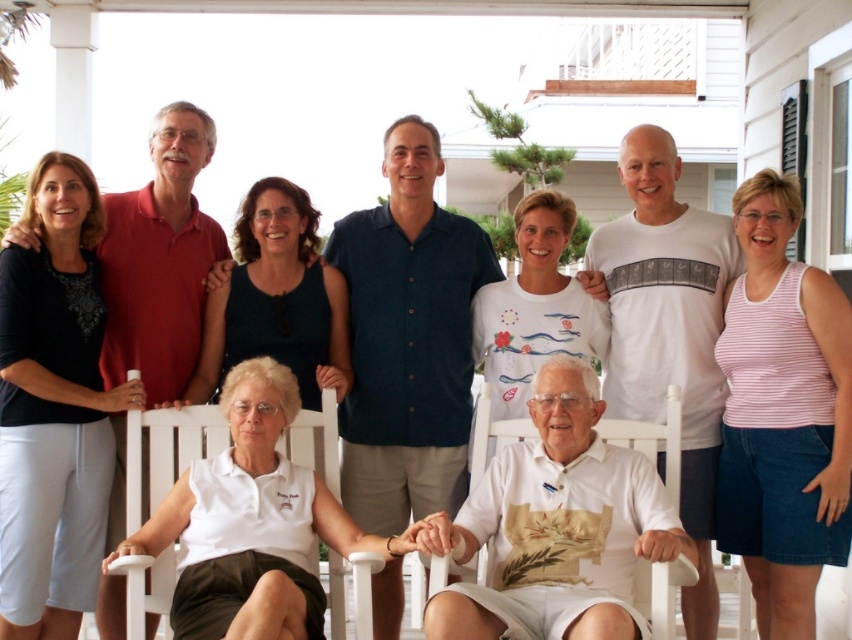
Which is in front, point (378, 561) or point (640, 595)?

Positioned in front is point (378, 561).

Between white wood chair at lower center and white plastic chair at center, which one has more height?

With more height is white wood chair at lower center.

The height and width of the screenshot is (640, 852). In order to click on white wood chair at lower center in this screenshot , I will do `click(167, 449)`.

You are a GUI agent. You are given a task and a screenshot of the screen. Output one action in this format:
    pyautogui.click(x=<x>, y=<y>)
    Task: Click on the white wood chair at lower center
    Image resolution: width=852 pixels, height=640 pixels.
    Given the screenshot: What is the action you would take?
    pyautogui.click(x=167, y=449)